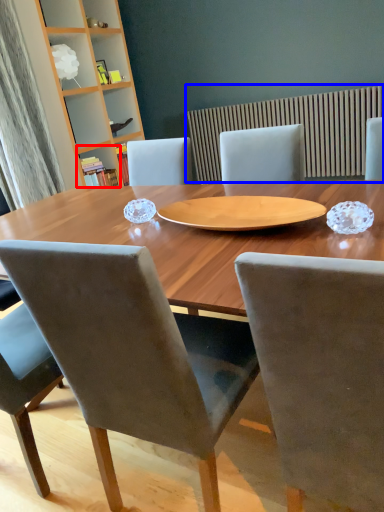
Question: Which of the following is the farthest to the observer, shelf (highlighted by a red box) or radiator (highlighted by a blue box)?

Choices:
 (A) shelf
 (B) radiator

Answer: (A)